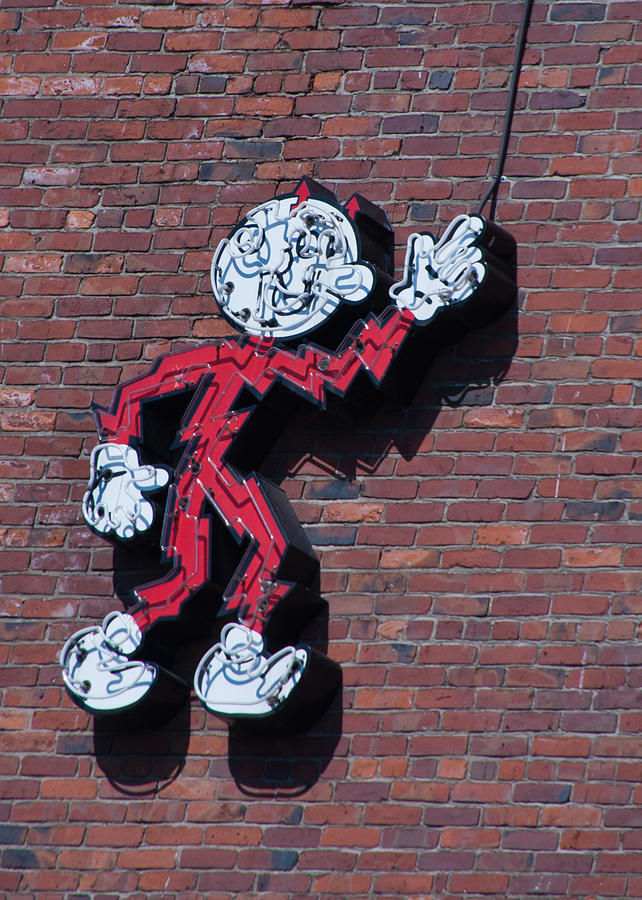
Image resolution: width=642 pixels, height=900 pixels. In order to click on wall in this screenshot , I will do `click(488, 576)`.